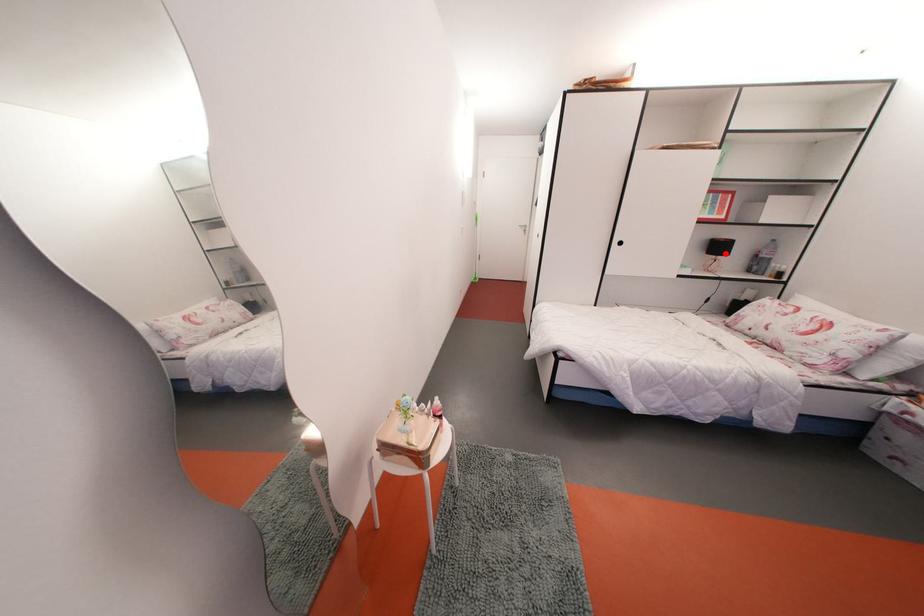
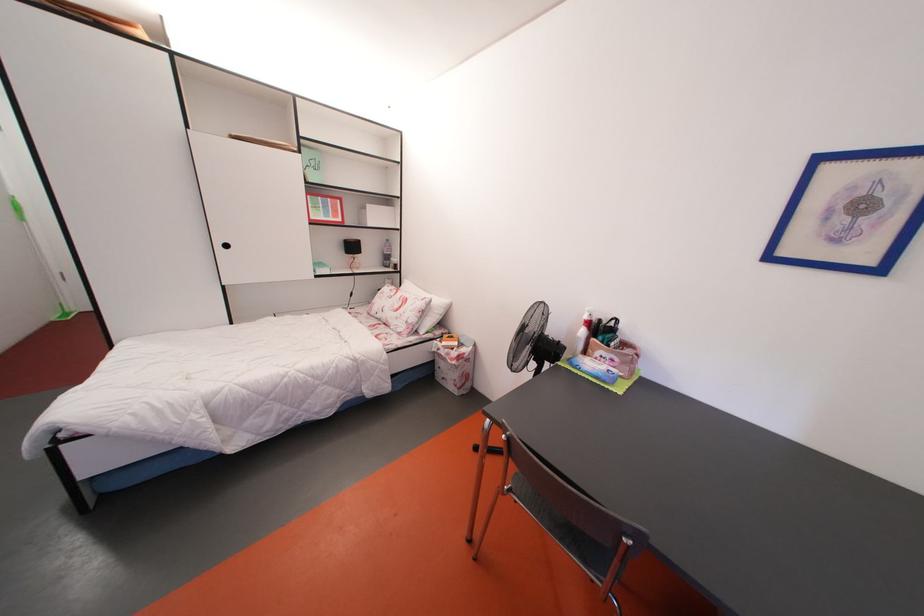
Question: I am providing you with two images of the same scene from different viewpoints. In image1, a red point is highlighted. Considering the same 3D point in image2, which of the following is correct?

Choices:
 (A) It is closer
 (B) It is farther

Answer: (A)